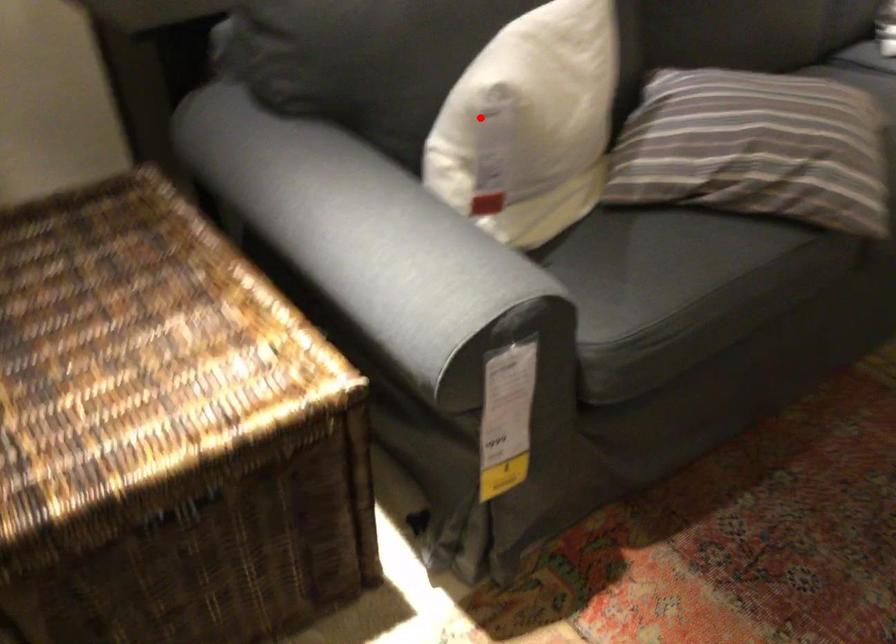
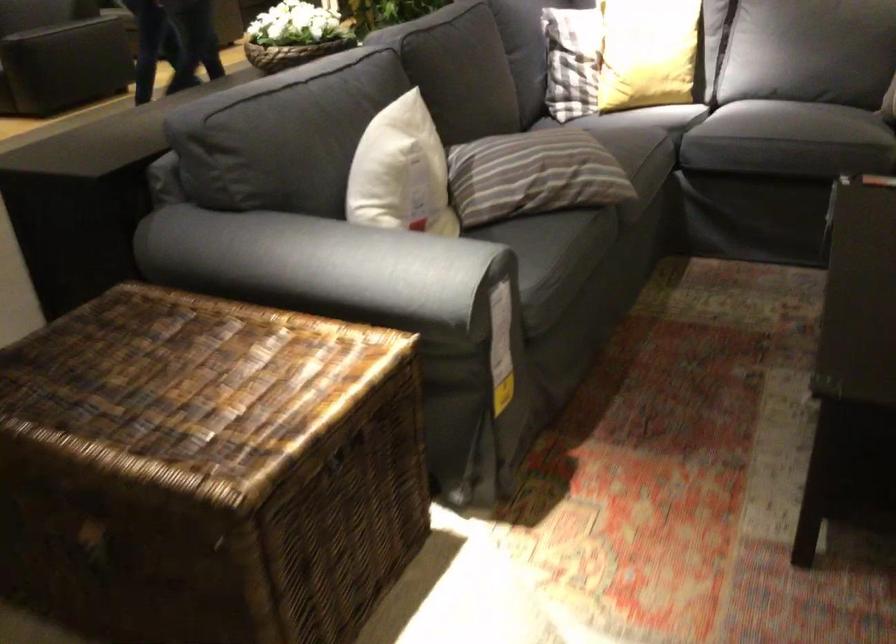
Question: I am providing you with two images of the same scene from different viewpoints. In image1, a red point is highlighted. Considering the same 3D point in image2, which of the following is correct?

Choices:
 (A) It is closer
 (B) It is farther

Answer: (B)